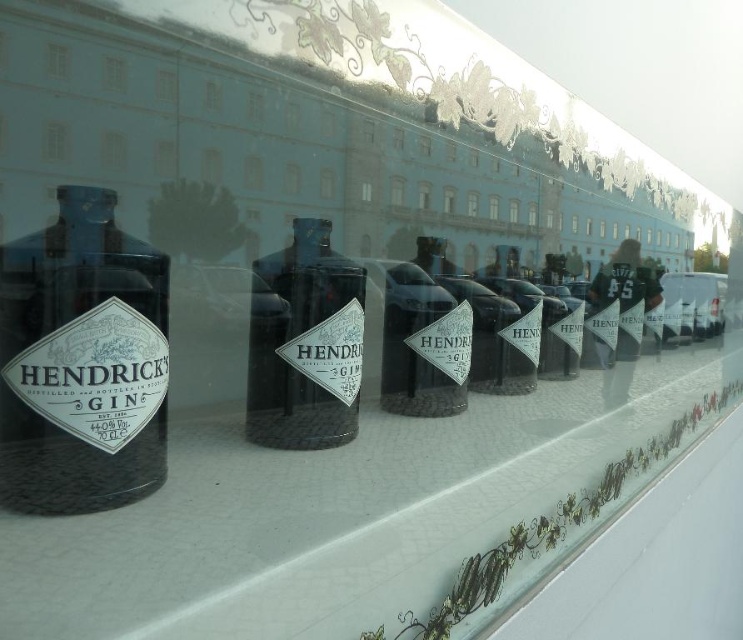
What do you see at coordinates (81, 362) in the screenshot? The image size is (743, 640). I see `matte black bottle at left` at bounding box center [81, 362].

Who is more distant from viewer, (36, 356) or (53, 76)?

Point (53, 76)

This screenshot has width=743, height=640. Find the location of `matte black bottle at left`. matte black bottle at left is located at coordinates [81, 362].

Between white textured surface at center and transparent glass window at upper left, which one appears on the right side from the viewer's perspective?

white textured surface at center is more to the right.

Is point (178, 572) less distant than point (65, 60)?

Yes, point (178, 572) is closer to viewer.

At what (x,y) coordinates should I click in order to perform the action: click on white textured surface at center. Please return your answer as a coordinate pair (x, y). Looking at the image, I should click on 357,515.

Does matte glass hendrick's gin bottle at center appear under transparent glass window at upper left?

Yes, matte glass hendrick's gin bottle at center is below transparent glass window at upper left.

In the scene shown: Which of these two, matte glass hendrick's gin bottle at center or transparent glass window at upper left, stands shorter?

With less height is transparent glass window at upper left.

Locate an element on the screen. matte glass hendrick's gin bottle at center is located at coordinates (302, 342).